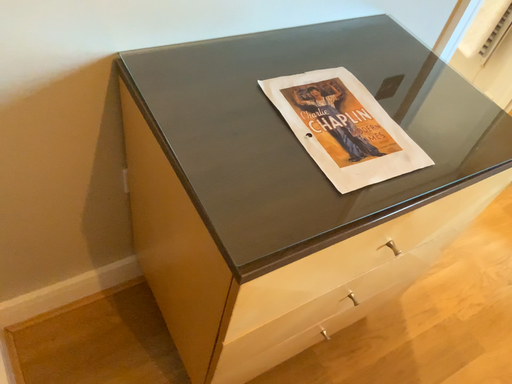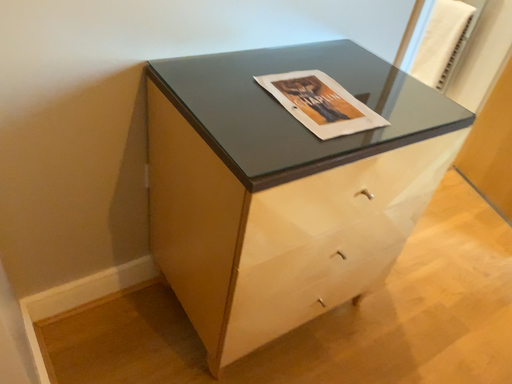
Question: How did the camera likely rotate when shooting the video?

Choices:
 (A) rotated downward
 (B) rotated upward

Answer: (B)